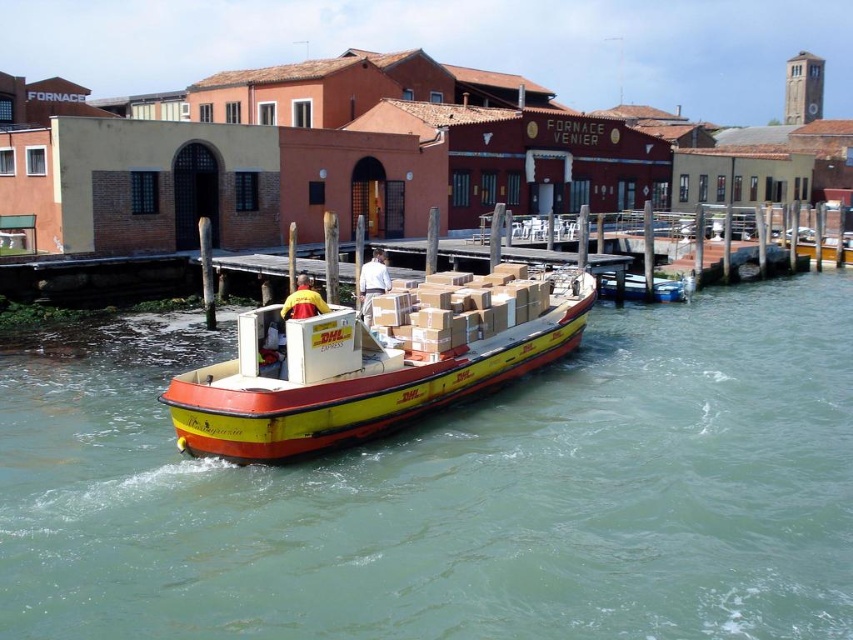
Question: Which of these objects is positioned farthest from the brown cardboard boxes at center?

Choices:
 (A) green water at center
 (B) yellow matte boat at center

Answer: (A)

Question: Is yellow matte boat at center above brown cardboard boxes at center?

Choices:
 (A) no
 (B) yes

Answer: (A)

Question: Does green water at center appear over brown cardboard boxes at center?

Choices:
 (A) no
 (B) yes

Answer: (A)

Question: Which point is farther to the camera?

Choices:
 (A) (495, 275)
 (B) (209, 428)

Answer: (A)

Question: From the image, what is the correct spatial relationship of green water at center in relation to brown cardboard boxes at center?

Choices:
 (A) right
 (B) left

Answer: (A)

Question: Which of these objects is positioned farthest from the brown cardboard boxes at center?

Choices:
 (A) green water at center
 (B) yellow matte boat at center

Answer: (A)